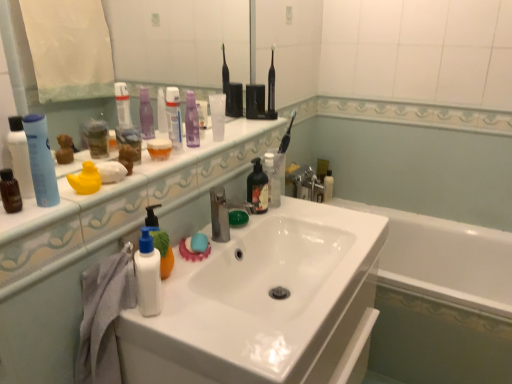
You are a GUI agent. You are given a task and a screenshot of the screen. Output one action in this format:
    pyautogui.click(x=<x>, y=<y>)
    Task: Click on the unoccupied region to the right of translucent plastic mouthwash at center, acting as the third mouthwash starting from the front
    This screenshot has width=512, height=384.
    Given the screenshot: What is the action you would take?
    pyautogui.click(x=203, y=151)